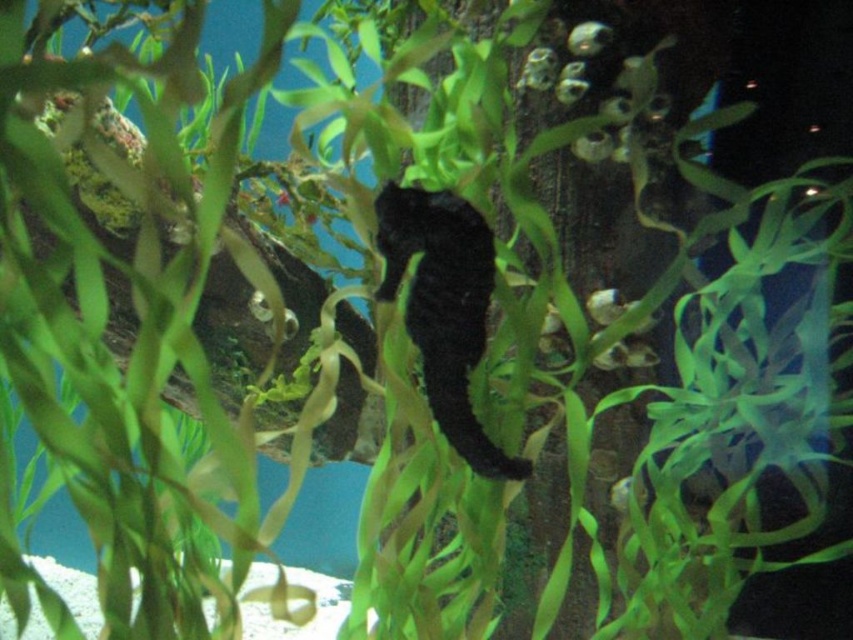
Question: Which object is the farthest from the black matte seahorse at center?

Choices:
 (A) shiny silver fish at upper center
 (B) translucent green fish at center

Answer: (A)

Question: Can you confirm if black matte seahorse at center is wider than translucent green fish at center?

Choices:
 (A) yes
 (B) no

Answer: (A)

Question: Among these points, which one is nearest to the camera?

Choices:
 (A) (635, 481)
 (B) (450, 394)

Answer: (B)

Question: Does black matte seahorse at center have a greater width compared to shiny silver fish at upper center?

Choices:
 (A) yes
 (B) no

Answer: (A)

Question: In this image, where is black matte seahorse at center located relative to translucent green fish at center?

Choices:
 (A) right
 (B) left

Answer: (B)

Question: Which point is closer to the camera?

Choices:
 (A) (381, 195)
 (B) (641, 504)

Answer: (A)